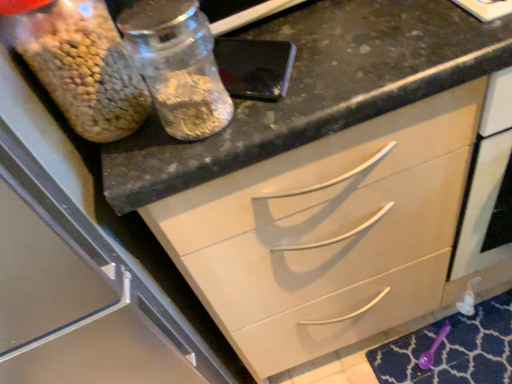
The width and height of the screenshot is (512, 384). Identify the location of translucent glass jar at upper left. (83, 67).

The image size is (512, 384). Describe the element at coordinates (178, 66) in the screenshot. I see `transparent glass jar at upper left` at that location.

This screenshot has width=512, height=384. What do you see at coordinates (316, 89) in the screenshot? I see `black granite countertop at upper center` at bounding box center [316, 89].

Where is `translucent glass jar at upper left`? This screenshot has height=384, width=512. translucent glass jar at upper left is located at coordinates (83, 67).

The height and width of the screenshot is (384, 512). Identify the location of food above the transparent glass jar at upper left (from the image's perspective). (83, 67).

How much distance is there between transparent glass jar at upper left and translucent glass jar at upper left?

A distance of 2.70 inches exists between transparent glass jar at upper left and translucent glass jar at upper left.

Between transparent glass jar at upper left and translucent glass jar at upper left, which one has larger size?

translucent glass jar at upper left is bigger.

Between transparent glass jar at upper left and translucent glass jar at upper left, which one has more height?

With more height is translucent glass jar at upper left.

Which is more to the right, purple plastic spoon at lower right or transparent glass jar at upper left?

From the viewer's perspective, purple plastic spoon at lower right appears more on the right side.

Between point (435, 349) and point (229, 118), which one is positioned in front?

The point (229, 118) is closer.

Looking at this image, is purple plastic spoon at lower right shorter than transparent glass jar at upper left?

Correct, purple plastic spoon at lower right is not as tall as transparent glass jar at upper left.

Which object is wider, black granite countertop at upper center or transparent glass jar at upper left?

black granite countertop at upper center is wider.

Is black granite countertop at upper center next to transparent glass jar at upper left and touching it?

No, black granite countertop at upper center is not with transparent glass jar at upper left.

Is the depth of black granite countertop at upper center greater than that of transparent glass jar at upper left?

That is True.

Locate an element on the screen. Image resolution: width=512 pixels, height=384 pixels. countertop located underneath the translucent glass jar at upper left (from a real-world perspective) is located at coordinates (316, 89).

Considering the relative sizes of black granite countertop at upper center and translucent glass jar at upper left in the image provided, is black granite countertop at upper center bigger than translucent glass jar at upper left?

Correct, black granite countertop at upper center is larger in size than translucent glass jar at upper left.

Do you think black granite countertop at upper center is within translucent glass jar at upper left, or outside of it?

black granite countertop at upper center is outside translucent glass jar at upper left.

Does point (242, 129) come farther from viewer compared to point (25, 46)?

Yes, it is behind point (25, 46).

Looking at the image, does translucent glass jar at upper left seem bigger or smaller compared to black granite countertop at upper center?

Clearly, translucent glass jar at upper left is smaller in size than black granite countertop at upper center.

Are translucent glass jar at upper left and black granite countertop at upper center making contact?

translucent glass jar at upper left is not next to black granite countertop at upper center, and they're not touching.

Could you tell me if translucent glass jar at upper left is facing black granite countertop at upper center?

No, translucent glass jar at upper left is not aimed at black granite countertop at upper center.

From the image's perspective, is translucent glass jar at upper left beneath black granite countertop at upper center?

No, from the image's perspective, translucent glass jar at upper left is not beneath black granite countertop at upper center.

Which point is more forward, (125,86) or (199,90)?

The point (199,90) is more forward.

Which object is positioned more to the left, translucent glass jar at upper left or transparent glass jar at upper left?

translucent glass jar at upper left.

Considering the relative sizes of translucent glass jar at upper left and transparent glass jar at upper left in the image provided, is translucent glass jar at upper left smaller than transparent glass jar at upper left?

Incorrect, translucent glass jar at upper left is not smaller in size than transparent glass jar at upper left.

From a real-world perspective, between translucent glass jar at upper left and transparent glass jar at upper left, who is vertically lower?

From a 3D spatial view, transparent glass jar at upper left is below.

Can you tell me how much black granite countertop at upper center and purple plastic spoon at lower right differ in facing direction?

28 degrees.

Does black granite countertop at upper center have a larger size compared to purple plastic spoon at lower right?

Correct, black granite countertop at upper center is larger in size than purple plastic spoon at lower right.

Are black granite countertop at upper center and purple plastic spoon at lower right making contact?

No, black granite countertop at upper center is not beside purple plastic spoon at lower right.

Which is behind, point (302, 60) or point (429, 365)?

The point (429, 365) is behind.

Identify the location of glass jar below the translucent glass jar at upper left (from the image's perspective). (178, 66).

This screenshot has width=512, height=384. I want to click on utensil on the right of transparent glass jar at upper left, so click(x=433, y=347).

Looking at this image, considering their positions, is transparent glass jar at upper left positioned further to translucent glass jar at upper left than black granite countertop at upper center?

black granite countertop at upper center lies further to translucent glass jar at upper left than the other object.

Looking at this image, from the image, which object appears to be nearer to purple plastic spoon at lower right, translucent glass jar at upper left or black granite countertop at upper center?

Among the two, black granite countertop at upper center is located nearer to purple plastic spoon at lower right.

Estimate the real-world distances between objects in this image. Which object is closer to translucent glass jar at upper left, black granite countertop at upper center or purple plastic spoon at lower right?

The object closer to translucent glass jar at upper left is black granite countertop at upper center.

Looking at the image, which one is located further to purple plastic spoon at lower right, transparent glass jar at upper left or black granite countertop at upper center?

transparent glass jar at upper left is further to purple plastic spoon at lower right.

Looking at the image, which one is located further to black granite countertop at upper center, translucent glass jar at upper left or purple plastic spoon at lower right?

purple plastic spoon at lower right.

Based on their spatial positions, is translucent glass jar at upper left or purple plastic spoon at lower right closer to transparent glass jar at upper left?

translucent glass jar at upper left is positioned closer to the anchor transparent glass jar at upper left.

When comparing their distances from transparent glass jar at upper left, does black granite countertop at upper center or purple plastic spoon at lower right seem further?

Result: Based on the image, purple plastic spoon at lower right appears to be further to transparent glass jar at upper left.

In the scene shown: Estimate the real-world distances between objects in this image. Which object is further from black granite countertop at upper center, translucent glass jar at upper left or transparent glass jar at upper left?

translucent glass jar at upper left.

What are the coordinates of `glass jar between translucent glass jar at upper left and black granite countertop at upper center` in the screenshot? It's located at (178, 66).

Identify the location of food located between transparent glass jar at upper left and purple plastic spoon at lower right in the depth direction. (83, 67).

Where is `countertop situated between translucent glass jar at upper left and purple plastic spoon at lower right from left to right`? The width and height of the screenshot is (512, 384). countertop situated between translucent glass jar at upper left and purple plastic spoon at lower right from left to right is located at coordinates (316, 89).

Find the location of `countertop between transparent glass jar at upper left and purple plastic spoon at lower right along the z-axis`. countertop between transparent glass jar at upper left and purple plastic spoon at lower right along the z-axis is located at coordinates (316, 89).